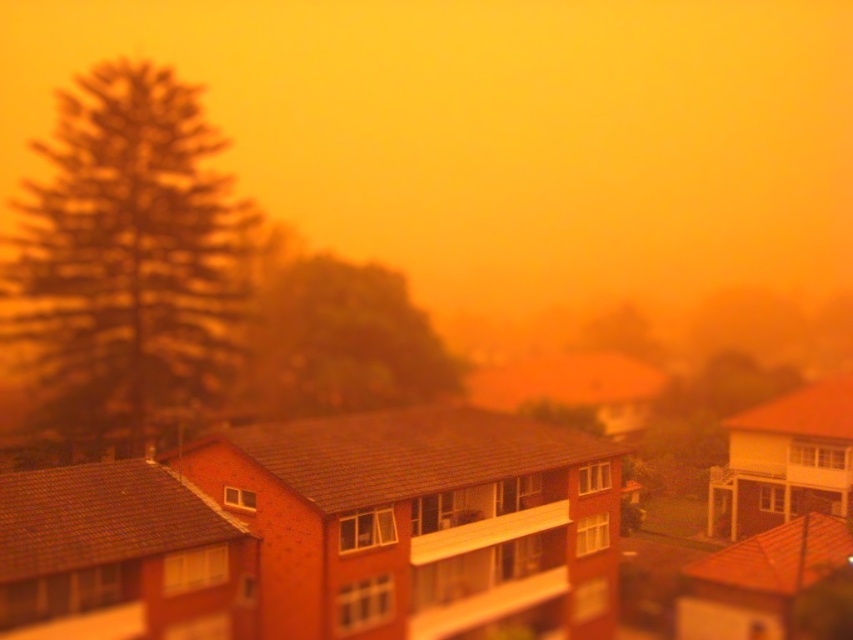
You are standing in the residential area looking at the green textured tree at left and the green leafy tree at center. Which tree appears closer to you?

The green textured tree at left appears closer to the viewer than the green leafy tree at center.

You are a photographer planning to capture a wide shot of the residential area with both the green textured tree at left and the green leafy tree at center in the frame. Based on their sizes, which tree would appear closer to the camera?

The green textured tree at left appears closer to the camera because it has a larger size compared to the green leafy tree at center.